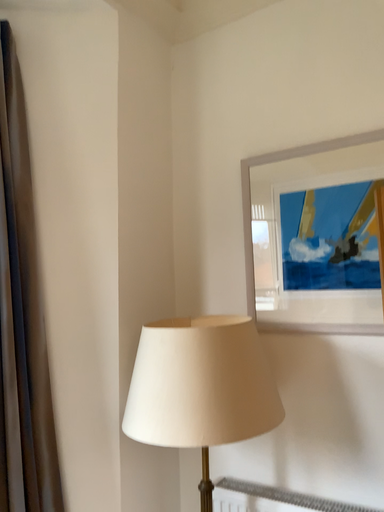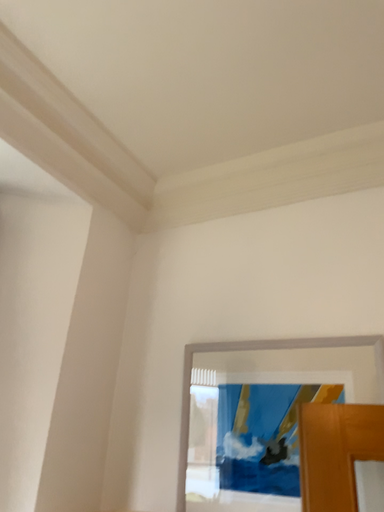
Question: How did the camera likely rotate when shooting the video?

Choices:
 (A) rotated downward
 (B) rotated upward

Answer: (B)